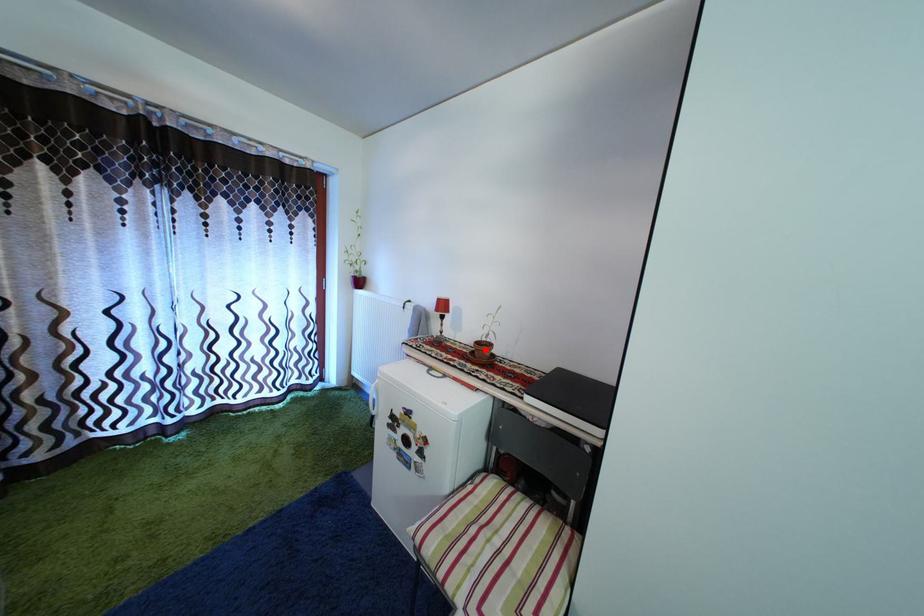
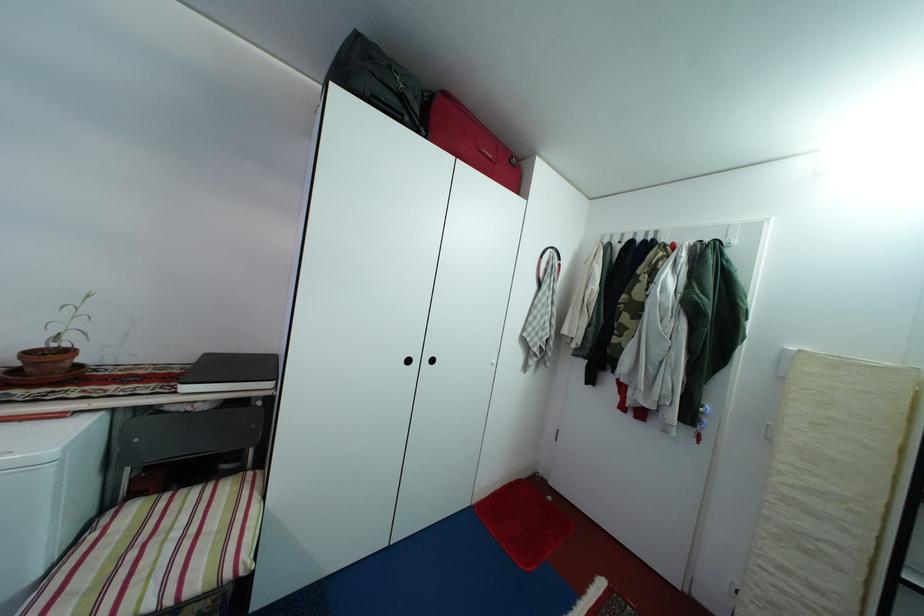
The point at the highlighted location is marked in the first image. Where is the corresponding point in the second image?

(38, 361)